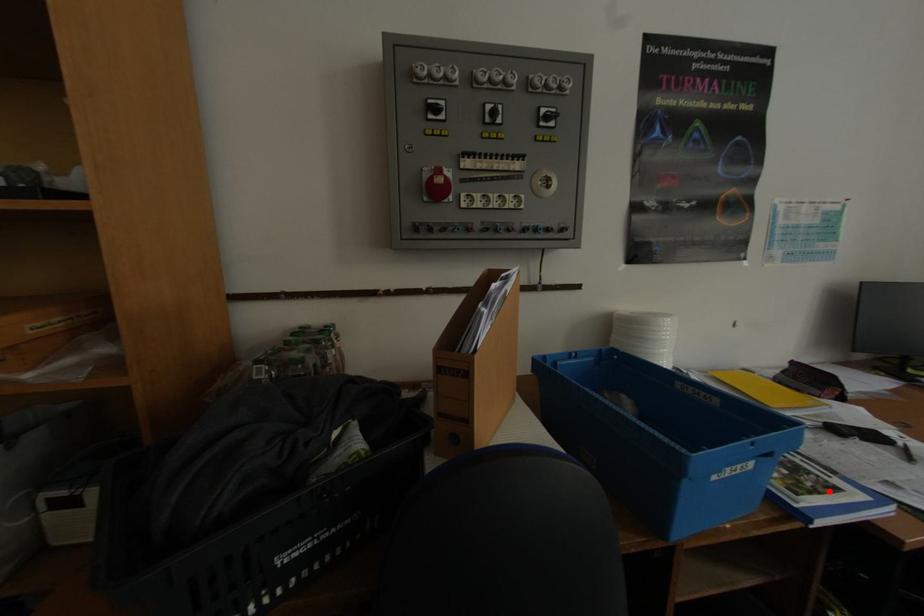
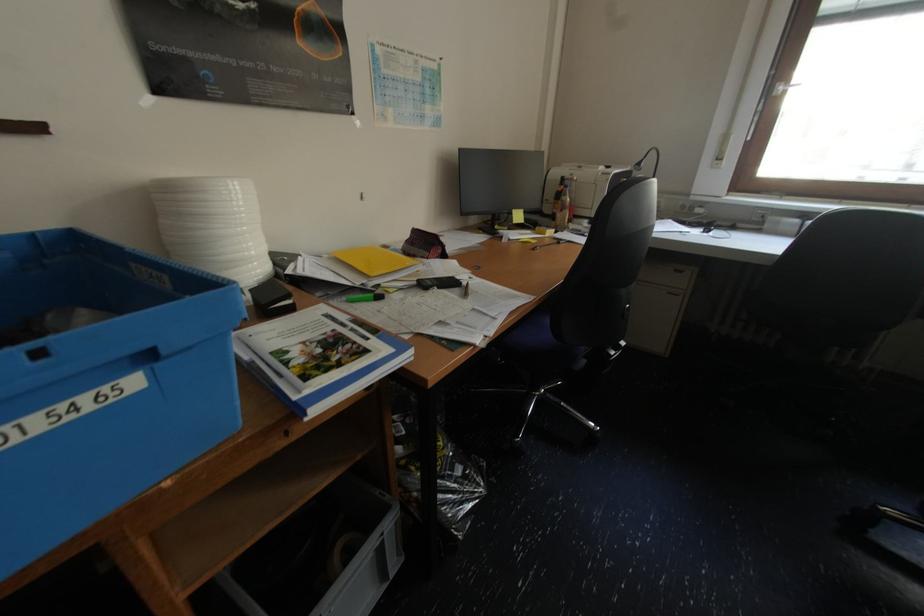
Find the pixel in the second image that matches the highlighted location in the first image.

(351, 363)